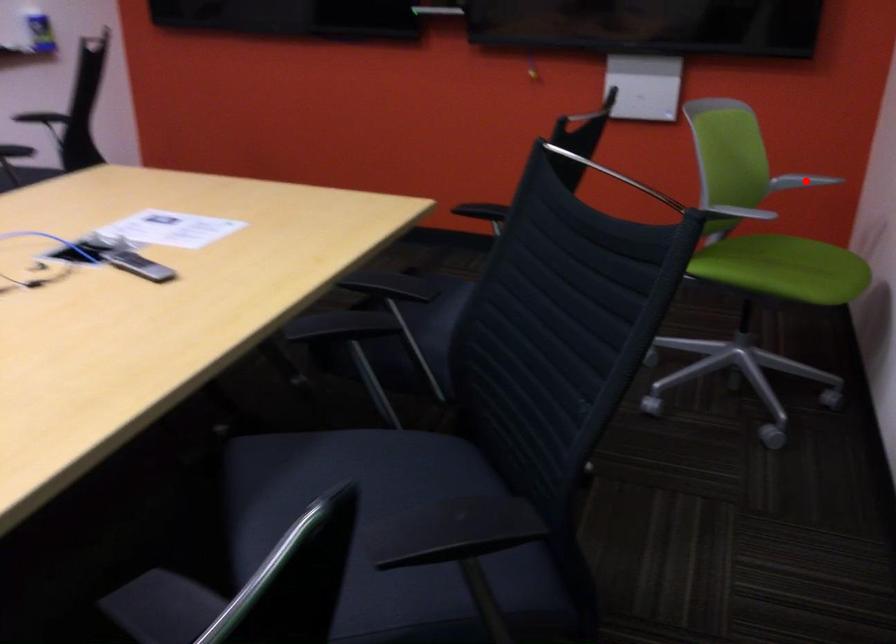
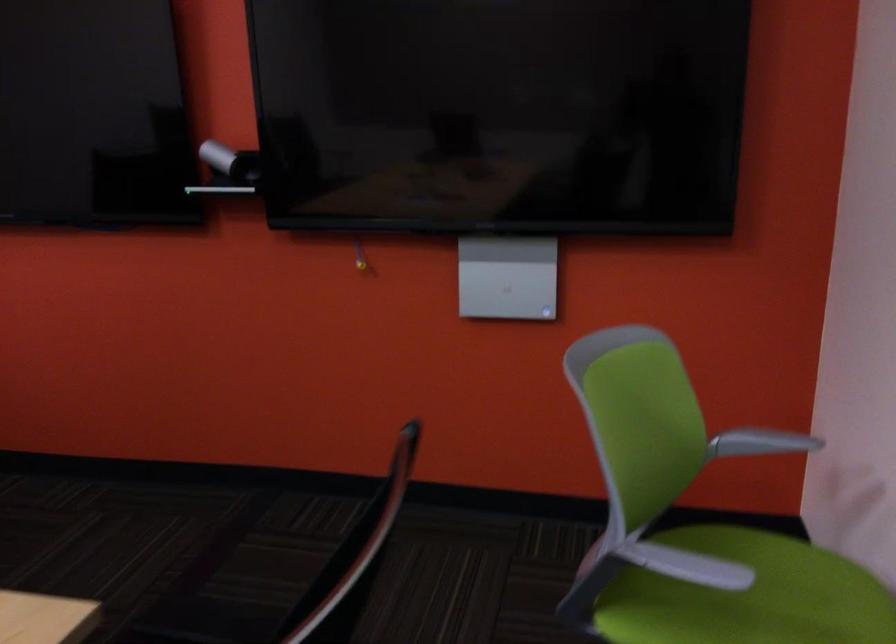
Where in the second image is the point corresponding to the highlighted location from the first image?

(760, 442)